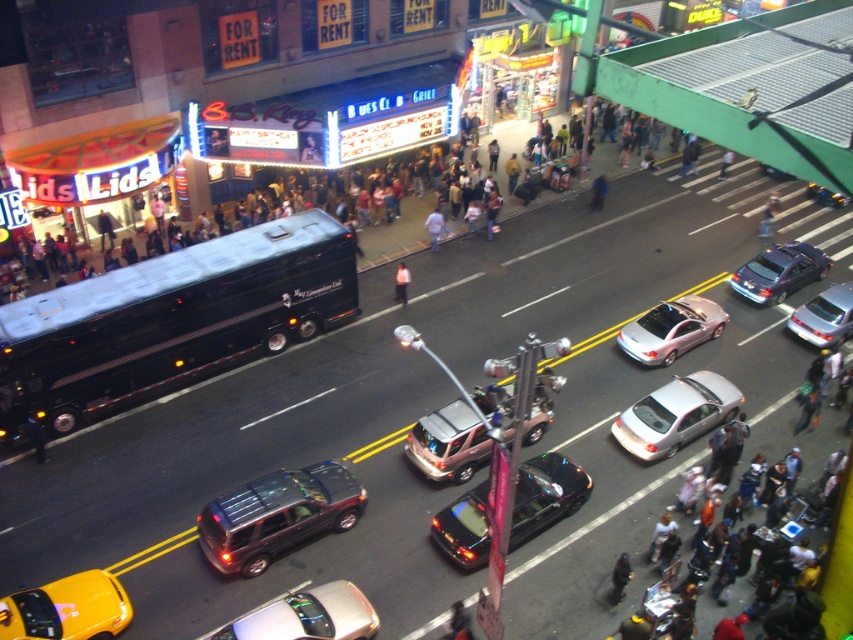
Question: Does yellow rubber taxi at lower left appear on the right side of light blue jeans at center?

Choices:
 (A) no
 (B) yes

Answer: (A)

Question: Estimate the real-world distances between objects in this image. Which object is farther from the satin silver sedan at center-right?

Choices:
 (A) pink fabric shirt at center
 (B) denim jacket at center

Answer: (A)

Question: Which point is farther to the camera?

Choices:
 (A) matte black bus at center
 (B) metallic silver suv at center

Answer: (A)

Question: Does matte black bus at center have a larger size compared to shiny silver sedan at center?

Choices:
 (A) no
 (B) yes

Answer: (B)

Question: Is metallic silver suv at center bigger than light blue jeans at crosswalk?

Choices:
 (A) yes
 (B) no

Answer: (A)

Question: Estimate the real-world distances between objects in this image. Which object is farther from the denim jacket at center?

Choices:
 (A) matte black bus at center
 (B) metallic silver suv at center
 (C) shiny silver sedan at center

Answer: (C)